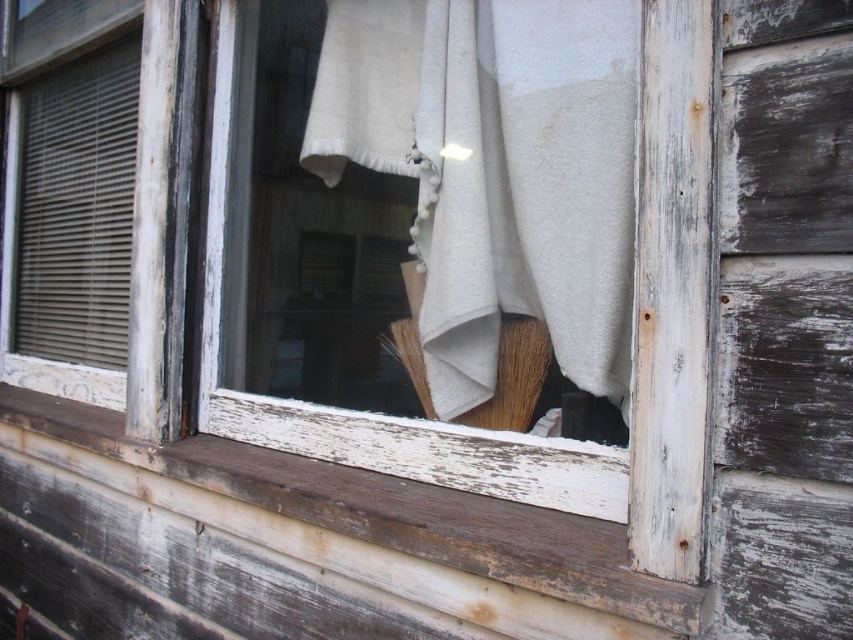
Question: Among these objects, which one is farthest from the camera?

Choices:
 (A) weathered wood at lower center
 (B) brown bristle brush at center

Answer: (B)

Question: Estimate the real-world distances between objects in this image. Which object is closer to the weathered wood at lower center?

Choices:
 (A) white cotton cloth at center
 (B) brown bristle brush at center

Answer: (B)

Question: Is white cotton cloth at center thinner than weathered wood at lower center?

Choices:
 (A) no
 (B) yes

Answer: (B)

Question: Which object appears closest to the camera in this image?

Choices:
 (A) weathered wood at lower center
 (B) white cotton cloth at center
 (C) brown bristle brush at center

Answer: (A)

Question: Can you confirm if white cotton cloth at center is positioned to the right of brown bristle brush at center?

Choices:
 (A) no
 (B) yes

Answer: (B)

Question: Can you confirm if white cotton cloth at center is positioned to the left of weathered wood at lower center?

Choices:
 (A) no
 (B) yes

Answer: (A)